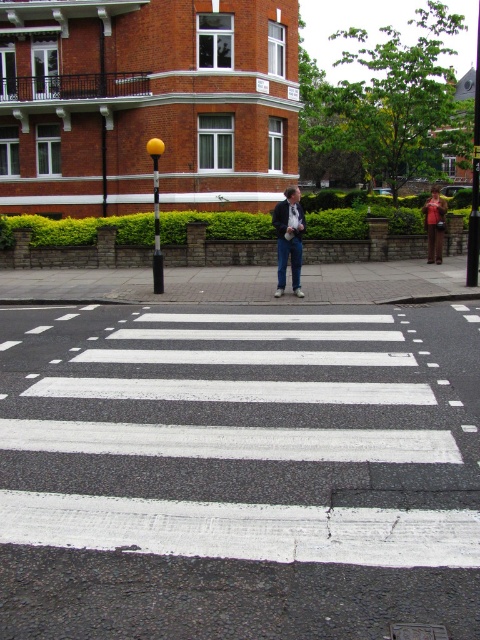
You are standing at the pedestrian crossing and want to walk towards the building. There are two points marked on the sidewalk. Which point should you walk towards first, point (x=299, y=209) or point (x=440, y=237)?

You should walk towards point (x=299, y=209) first because it is in front of point (x=440, y=237), meaning it is closer to your current position at the pedestrian crossing.

You are a delivery person trying to find the correct address. You see the dark blue jeans at center. Based on their position, can you determine if they are closer to the pedestrian crossing or the building?

The dark blue jeans at center is located at point (x=288, y=237), which places them closer to the pedestrian crossing than the building.

You are standing at the point marked by coordinates point (x=288, y=237) in the image. Looking around, you see the pedestrian crossing in front of you and a person in dark blue jeans at center. Which direction should you walk to reach the pedestrian crossing?

The dark blue jeans at center is located at point (x=288, y=237), so you are already at the pedestrian crossing. You don not need to move further.